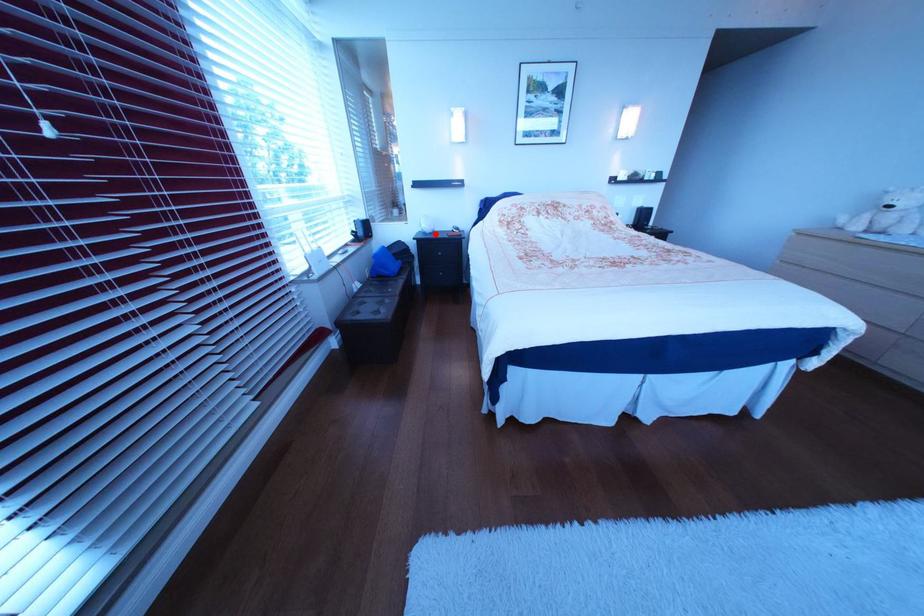
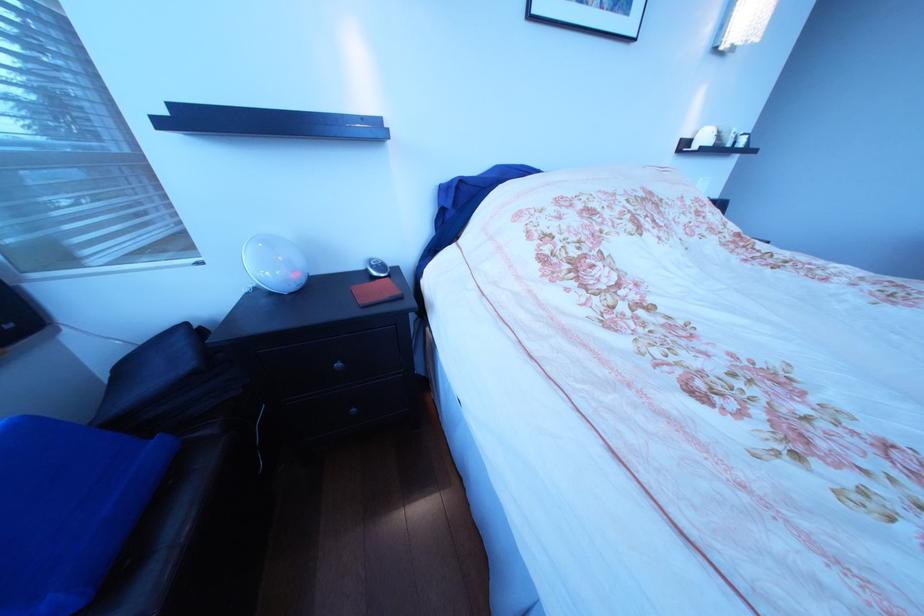
Question: I am providing you with two images of the same scene from different viewpoints. In image1, a red point is highlighted. Considering the same 3D point in image2, which of the following is correct?

Choices:
 (A) It is closer
 (B) It is farther

Answer: (B)